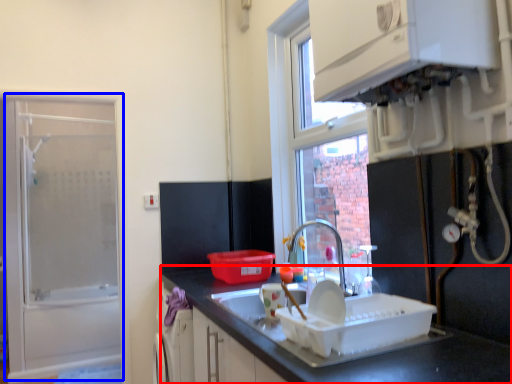
Question: Which object is closer to the camera taking this photo, countertop (highlighted by a red box) or screen door (highlighted by a blue box)?

Choices:
 (A) countertop
 (B) screen door

Answer: (A)